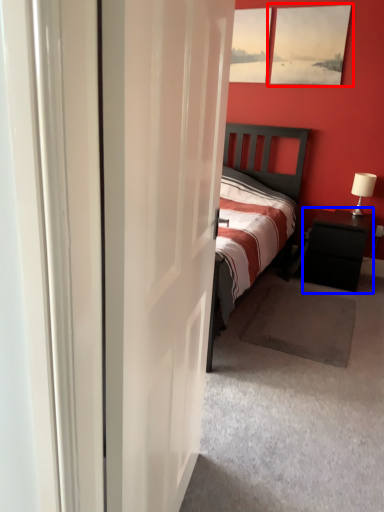
Question: Which point is further to the camera, picture frame (highlighted by a red box) or nightstand (highlighted by a blue box)?

Choices:
 (A) picture frame
 (B) nightstand

Answer: (A)